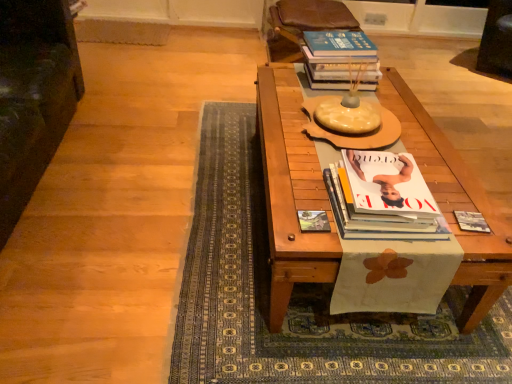
This screenshot has width=512, height=384. In order to click on vacant location behind matte black book at right, which is the 2th book in front-to-back order in this screenshot , I will do `click(453, 197)`.